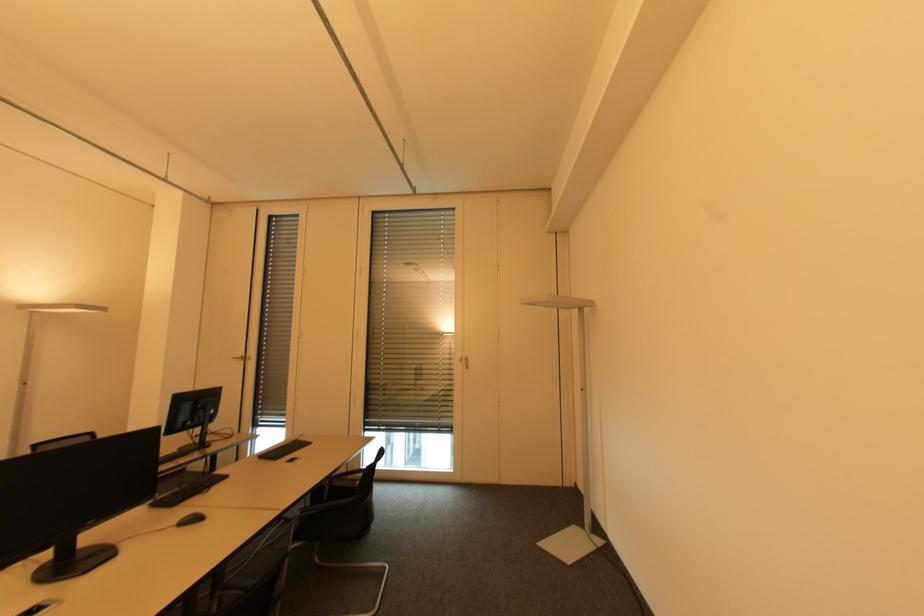
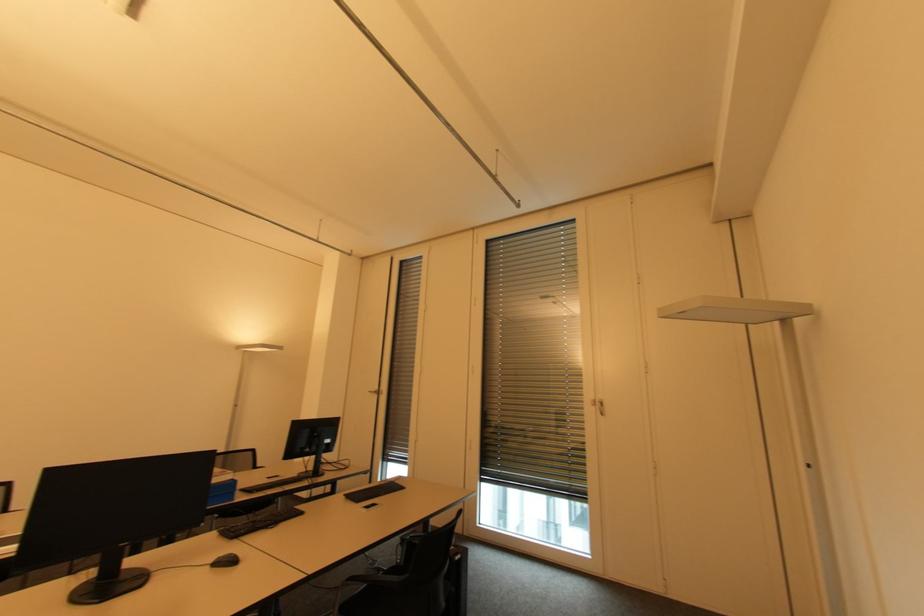
Find the pixel in the second image that matches point (468, 369) in the first image.

(603, 416)